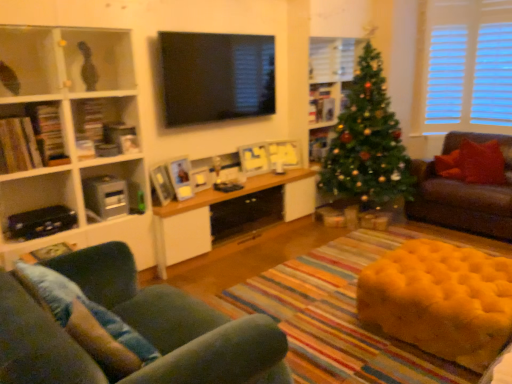
Question: From the image's perspective, relative to matte white bookshelf at left, which appears as the 5th shelf when viewed from the back, is yellow tufted ottoman at lower right above or below?

Choices:
 (A) below
 (B) above

Answer: (A)

Question: Is point (449, 276) closer or farther from the camera than point (122, 59)?

Choices:
 (A) farther
 (B) closer

Answer: (B)

Question: Which is nearer to the brown leather couch at right, arranged as the first studio couch when viewed from the right?

Choices:
 (A) wooden cabinet at center
 (B) yellow tufted ottoman at lower right
 (C) black glossy tv at upper center
 (D) wooden picture frame at center, which ranks as the second shelf in back-to-front order
 (E) velvet green sofa at lower left, the 2th studio couch when ordered from back to front

Answer: (D)

Question: Based on their relative distances, which object is farther from the denim cushion at lower left, acting as the first pillow starting from the front?

Choices:
 (A) wooden bookshelf at left, the 5th shelf viewed from the right
 (B) wooden cabinet at center
 (C) velvet green sofa at lower left, acting as the second studio couch starting from the top
 (D) green textured christmas tree at center
 (E) black glossy tv at upper center

Answer: (D)